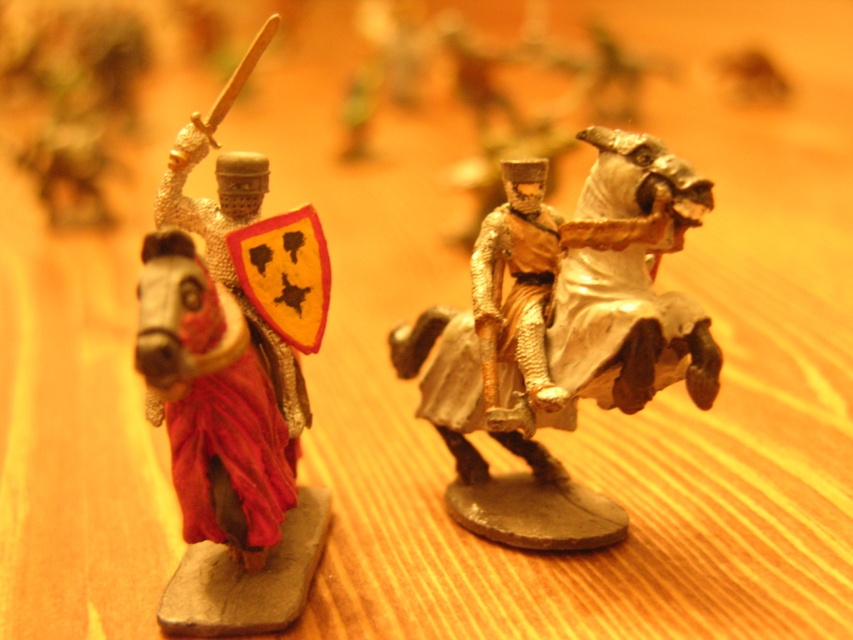
Does metallic silver horse at left have a lesser height compared to gold metallic horse at center?

No, metallic silver horse at left is not shorter than gold metallic horse at center.

Is point (264, 570) farther from viewer compared to point (546, 328)?

Yes, point (264, 570) is farther from viewer.

The image size is (853, 640). Identify the location of metallic silver horse at left. (233, 381).

This screenshot has width=853, height=640. What are the coordinates of `metallic silver horse at left` in the screenshot? It's located at (233, 381).